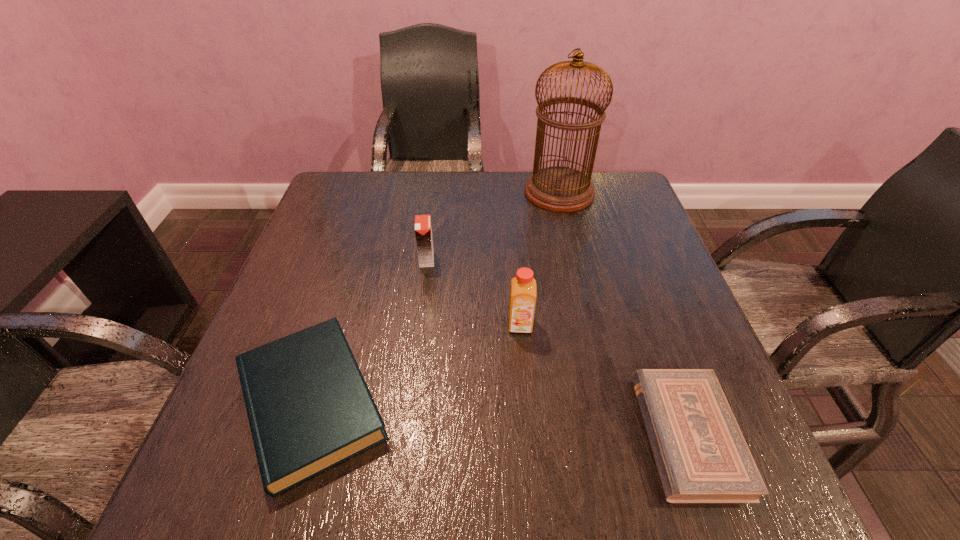
The height and width of the screenshot is (540, 960). Find the location of `vacant area situated 0.250m on the front-facing side of the tallest object`. vacant area situated 0.250m on the front-facing side of the tallest object is located at coordinates (434, 192).

Locate an element on the screen. free space located 0.300m on the front-facing side of the tallest object is located at coordinates (417, 192).

What are the coordinates of `free point located 0.180m on the front and back of the nearer orange juice` in the screenshot? It's located at (528, 420).

Image resolution: width=960 pixels, height=540 pixels. I want to click on free region located 0.220m on the left of the shorter orange juice, so click(324, 259).

Locate an element on the screen. The image size is (960, 540). free space located on the back of the second shortest object is located at coordinates (365, 228).

In order to click on free space located 0.380m on the spine side of the shortest object in this screenshot , I will do click(x=410, y=435).

Find the location of a particular element. vacant space located on the spine side of the shortest object is located at coordinates (490, 435).

At what (x,y) coordinates should I click in order to perform the action: click on vacant space located on the spine side of the shortest object. Please return your answer as a coordinate pair (x, y). The image size is (960, 540). Looking at the image, I should click on (613, 435).

Identify the location of object located at the far edge. (562, 189).

Locate an element on the screen. This screenshot has height=540, width=960. book that is at the near edge is located at coordinates (309, 408).